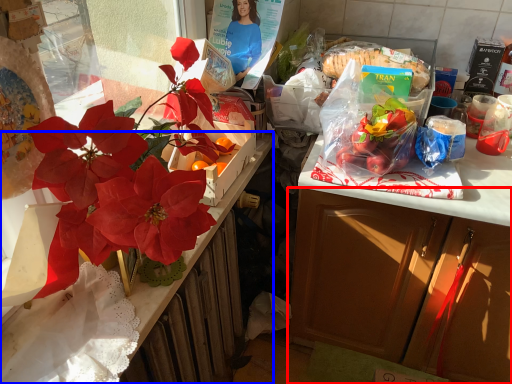
Question: Which object is further to the camera taking this photo, cabinetry (highlighted by a red box) or desk (highlighted by a blue box)?

Choices:
 (A) cabinetry
 (B) desk

Answer: (A)